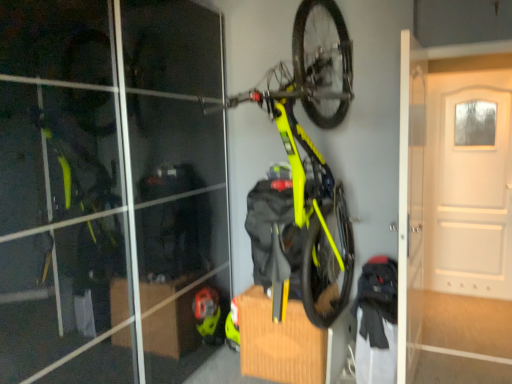
This screenshot has height=384, width=512. What do you see at coordinates (305, 168) in the screenshot?
I see `neon yellow matte bicycle at upper center` at bounding box center [305, 168].

Find the location of a particular element. This screenshot has width=512, height=384. neon yellow matte bicycle at upper center is located at coordinates (305, 168).

Where is `white matte door at upper right`? This screenshot has width=512, height=384. white matte door at upper right is located at coordinates (469, 184).

Measure the distance between white matte door at upper right and camera.

white matte door at upper right and camera are 3.62 meters apart.

Describe the element at coordinates (469, 184) in the screenshot. I see `white matte door at upper right` at that location.

This screenshot has height=384, width=512. Identify the location of neon yellow matte bicycle at upper center. (305, 168).

Between neon yellow matte bicycle at upper center and white matte door at upper right, which one appears on the right side from the viewer's perspective?

white matte door at upper right is more to the right.

Is neon yellow matte bicycle at upper center in front of white matte door at upper right?

Yes, it is in front of white matte door at upper right.

Which is farther, (300, 87) or (431, 252)?

The point (431, 252) is farther.

From the image's perspective, relative to white matte door at upper right, is neon yellow matte bicycle at upper center above or below?

neon yellow matte bicycle at upper center is above white matte door at upper right.

From a real-world perspective, is neon yellow matte bicycle at upper center positioned over white matte door at upper right based on gravity?

Yes, from a real-world perspective, neon yellow matte bicycle at upper center is on top of white matte door at upper right.

Between neon yellow matte bicycle at upper center and white matte door at upper right, which one has larger width?

With larger width is neon yellow matte bicycle at upper center.

Which of these two, neon yellow matte bicycle at upper center or white matte door at upper right, stands shorter?

neon yellow matte bicycle at upper center is shorter.

Looking at the image, does neon yellow matte bicycle at upper center seem bigger or smaller compared to white matte door at upper right?

Considering their sizes, neon yellow matte bicycle at upper center takes up more space than white matte door at upper right.

Is white matte door at upper right surrounded by neon yellow matte bicycle at upper center?

That's incorrect, white matte door at upper right is not inside neon yellow matte bicycle at upper center.

Is neon yellow matte bicycle at upper center not near white matte door at upper right?

Yes.

Is neon yellow matte bicycle at upper center positioned with its back to white matte door at upper right?

No, neon yellow matte bicycle at upper center is not facing away from white matte door at upper right.

How many degrees apart are the facing directions of neon yellow matte bicycle at upper center and white matte door at upper right?

The facing directions of neon yellow matte bicycle at upper center and white matte door at upper right are 2.57 degrees apart.

At what (x,y) coordinates should I click in order to perform the action: click on door located behind the neon yellow matte bicycle at upper center. Please return your answer as a coordinate pair (x, y). Image resolution: width=512 pixels, height=384 pixels. Looking at the image, I should click on (469, 184).

Based on their positions, is white matte door at upper right located to the left or right of neon yellow matte bicycle at upper center?

white matte door at upper right is positioned on neon yellow matte bicycle at upper center's right side.

From the picture: Is white matte door at upper right in front of or behind neon yellow matte bicycle at upper center in the image?

Clearly, white matte door at upper right is behind neon yellow matte bicycle at upper center.

Is point (495, 206) positioned before point (327, 252)?

That is False.

From the image's perspective, is white matte door at upper right above or below neon yellow matte bicycle at upper center?

white matte door at upper right is below neon yellow matte bicycle at upper center.

From a real-world perspective, which object rests below the other?

In real-world perspective, white matte door at upper right is lower.

Which of these two, white matte door at upper right or neon yellow matte bicycle at upper center, is thinner?

With smaller width is white matte door at upper right.

In terms of height, does white matte door at upper right look taller or shorter compared to neon yellow matte bicycle at upper center?

Clearly, white matte door at upper right is taller compared to neon yellow matte bicycle at upper center.

Between white matte door at upper right and neon yellow matte bicycle at upper center, which one has larger size?

Bigger between the two is neon yellow matte bicycle at upper center.

Is neon yellow matte bicycle at upper center completely or partially inside white matte door at upper right?

Actually, neon yellow matte bicycle at upper center is outside white matte door at upper right.

Are white matte door at upper right and neon yellow matte bicycle at upper center making contact?

No, white matte door at upper right is not beside neon yellow matte bicycle at upper center.

Is white matte door at upper right facing away from neon yellow matte bicycle at upper center?

That's not correct — white matte door at upper right is not looking away from neon yellow matte bicycle at upper center.

How many degrees apart are the facing directions of white matte door at upper right and neon yellow matte bicycle at upper center?

The facing directions of white matte door at upper right and neon yellow matte bicycle at upper center are 2.57 degrees apart.

Measure the distance from white matte door at upper right to neon yellow matte bicycle at upper center.

They are 1.86 meters apart.

Where is `bicycle in front of the white matte door at upper right`? The image size is (512, 384). bicycle in front of the white matte door at upper right is located at coordinates (305, 168).

Where is `door lying on the right of neon yellow matte bicycle at upper center`? Image resolution: width=512 pixels, height=384 pixels. door lying on the right of neon yellow matte bicycle at upper center is located at coordinates [469, 184].

This screenshot has width=512, height=384. I want to click on bicycle above the white matte door at upper right (from a real-world perspective), so click(x=305, y=168).